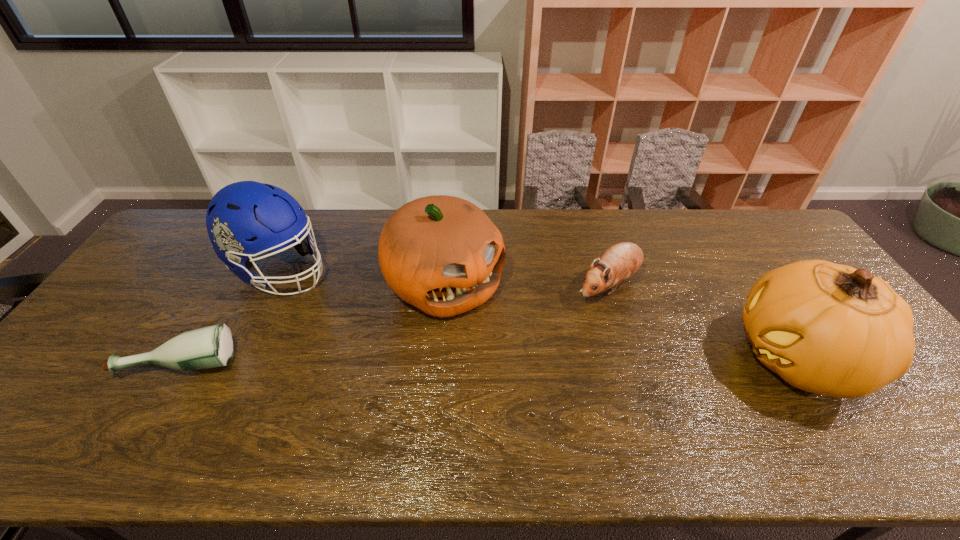
This screenshot has height=540, width=960. I want to click on vacant space that satisfies the following two spatial constraints: 1. on the back side of the football helmet; 2. on the right side of the shortest object, so click(238, 269).

Identify the location of vacant space that satisfies the following two spatial constraints: 1. on the back side of the bottle; 2. on the left side of the second object from right to left. Image resolution: width=960 pixels, height=540 pixels. (228, 287).